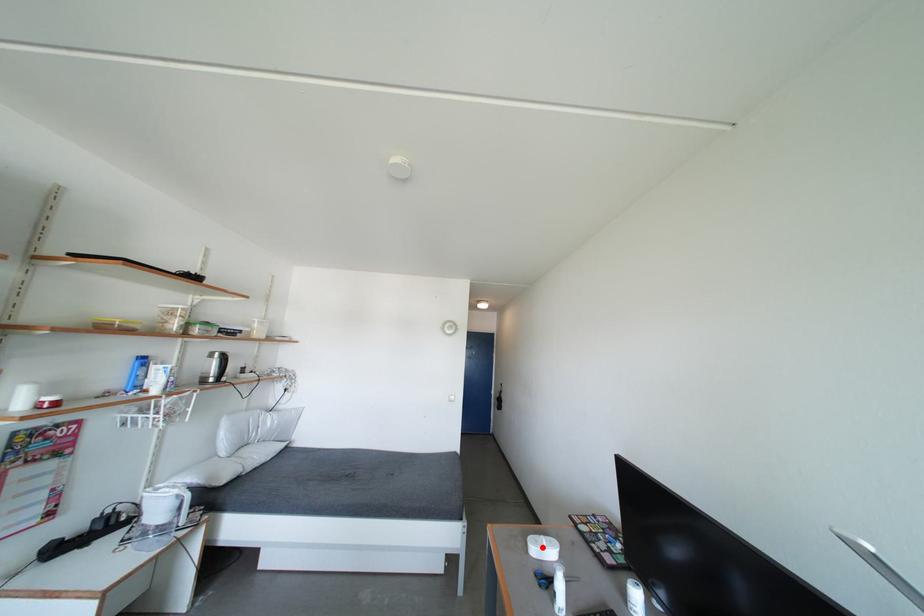
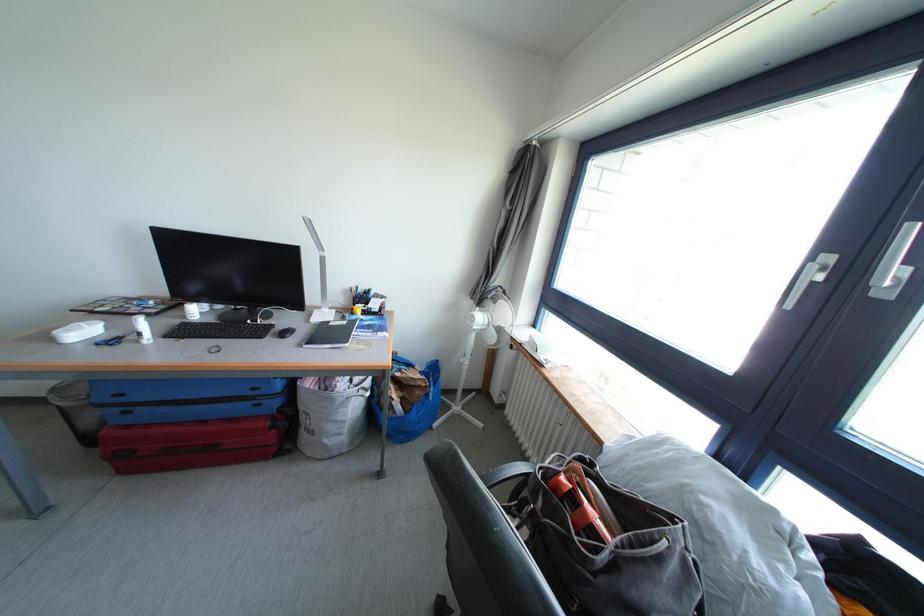
Where in the second image is the point corresponding to the highlighted location from the first image?

(78, 336)